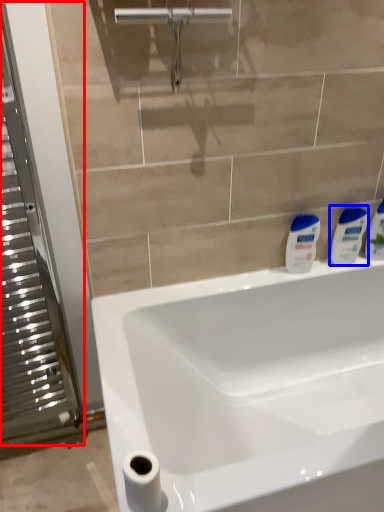
Question: Which object is further to the camera taking this photo, screen door (highlighted by a red box) or toiletry (highlighted by a blue box)?

Choices:
 (A) screen door
 (B) toiletry

Answer: (B)